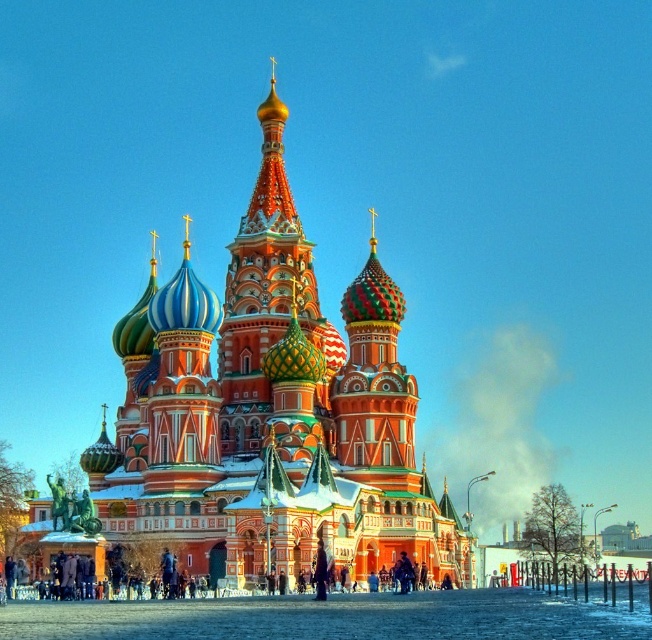
You are a photographer planning to capture the entire structure of the polychrome mosaic church at center and the polychrome mosaic dome at center in a single wide shot. Based on their sizes, do you think you can fit both into your camera frame without needing to move closer or further away?

The polychrome mosaic church at center might be wider than the polychrome mosaic dome at center, so it is possible to fit both into the frame as long as the camera can accommodate the width of the church, which is likely the broader of the two structures.

Based on the photo, you are a tourist standing in front of the polychrome mosaic church at center and the polychrome mosaic dome at center. Which structure do you see towering higher above the other?

The polychrome mosaic church at center is taller than the polychrome mosaic dome at center, so the church towers higher above the dome.